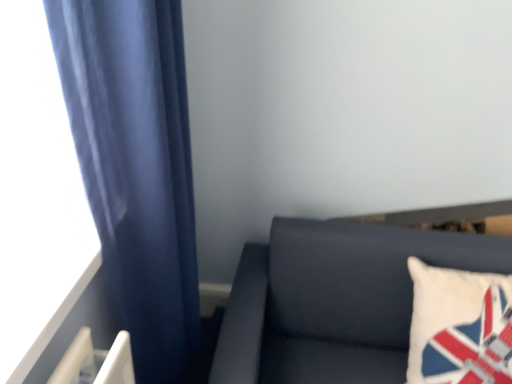
Question: Is dark gray fabric couch at lower right closer to the viewer compared to white fabric pillow at right?

Choices:
 (A) yes
 (B) no

Answer: (A)

Question: From a real-world perspective, is dark gray fabric couch at lower right located beneath white fabric pillow at right?

Choices:
 (A) yes
 (B) no

Answer: (A)

Question: Considering the relative positions of dark gray fabric couch at lower right and white fabric pillow at right in the image provided, is dark gray fabric couch at lower right behind white fabric pillow at right?

Choices:
 (A) yes
 (B) no

Answer: (B)

Question: Considering the relative positions of dark gray fabric couch at lower right and white fabric pillow at right in the image provided, is dark gray fabric couch at lower right to the right of white fabric pillow at right from the viewer's perspective?

Choices:
 (A) no
 (B) yes

Answer: (A)

Question: From a real-world perspective, is dark gray fabric couch at lower right over white fabric pillow at right?

Choices:
 (A) no
 (B) yes

Answer: (A)

Question: Looking at their shapes, would you say dark gray fabric couch at lower right is wider or thinner than white fabric pillow at right?

Choices:
 (A) wide
 (B) thin

Answer: (A)

Question: Based on their sizes in the image, would you say dark gray fabric couch at lower right is bigger or smaller than white fabric pillow at right?

Choices:
 (A) small
 (B) big

Answer: (B)

Question: Does point (315, 380) appear closer or farther from the camera than point (486, 372)?

Choices:
 (A) closer
 (B) farther

Answer: (B)

Question: From their relative heights in the image, would you say dark gray fabric couch at lower right is taller or shorter than white fabric pillow at right?

Choices:
 (A) short
 (B) tall

Answer: (B)

Question: From the image's perspective, relative to white fabric pillow at right, is satin blue curtain at left above or below?

Choices:
 (A) below
 (B) above

Answer: (B)

Question: In the image, is satin blue curtain at left on the left side or the right side of white fabric pillow at right?

Choices:
 (A) right
 (B) left

Answer: (B)

Question: Is satin blue curtain at left bigger or smaller than white fabric pillow at right?

Choices:
 (A) big
 (B) small

Answer: (A)

Question: From a real-world perspective, is satin blue curtain at left above or below white fabric pillow at right?

Choices:
 (A) above
 (B) below

Answer: (A)

Question: Considering the positions of point (315, 288) and point (114, 180), is point (315, 288) closer or farther from the camera than point (114, 180)?

Choices:
 (A) closer
 (B) farther

Answer: (B)

Question: From their relative heights in the image, would you say dark gray fabric couch at lower right is taller or shorter than satin blue curtain at left?

Choices:
 (A) tall
 (B) short

Answer: (B)